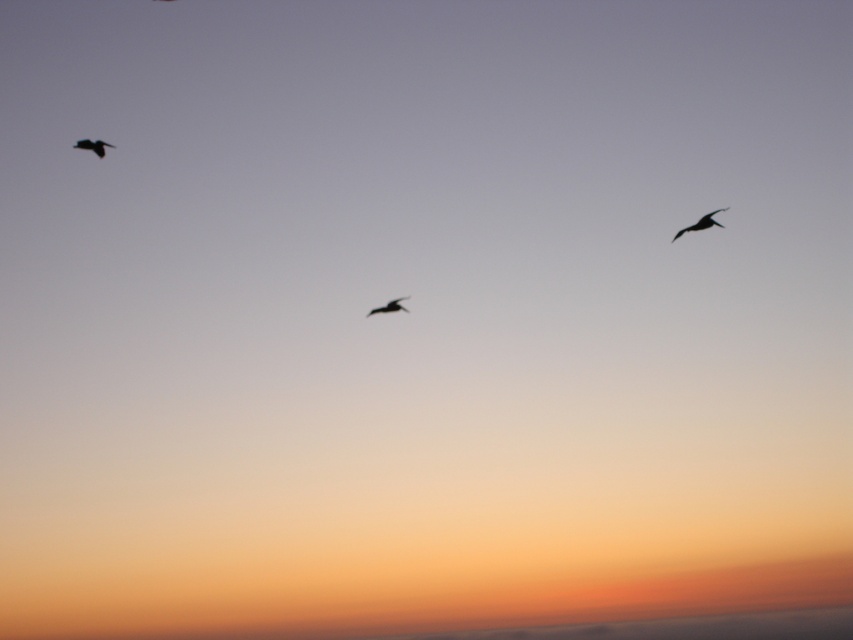
You are standing on the ground and looking at the two birds in the sky. The coordinates of the first bird are point [692,225] and the second bird are point 0.647, 0.188. How far apart are the two birds from each other?

The two birds are 36.51 meters apart.

You are an ornithologist observing birds in the sky. You notice the silhouette feathered bird at upper left and the black matte bird at center. Which bird appears larger in size from your observation point?

The silhouette feathered bird at upper left is much taller than the black matte bird at center, so it appears larger in size from your observation point.

You are a drone operator trying to capture aerial footage of the silhouette feathered bird at upper left and the black matte bird at center. Your drone has a maximum operational range of 20 feet. Can you film both birds without exceeding the drone range limit?

The distance between the silhouette feathered bird at upper left and the black matte bird at center is 24.01 feet, which exceeds the drone operator maximum operational range of 20 feet. Therefore, the drone cannot film both birds without exceeding the range limit.